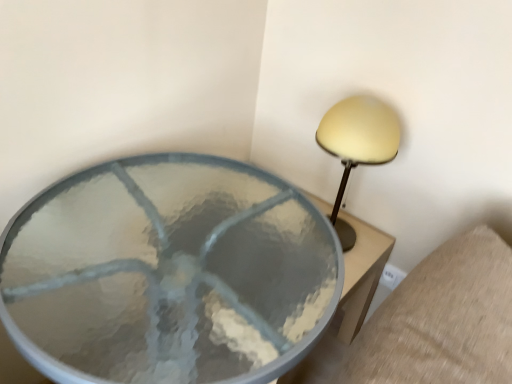
Question: From the image's perspective, is clear glass table at center above matte yellow lampshade at upper right?

Choices:
 (A) no
 (B) yes

Answer: (A)

Question: Can you confirm if clear glass table at center is taller than matte yellow lampshade at upper right?

Choices:
 (A) yes
 (B) no

Answer: (A)

Question: From a real-world perspective, is clear glass table at center physically above matte yellow lampshade at upper right?

Choices:
 (A) no
 (B) yes

Answer: (A)

Question: From a real-world perspective, does clear glass table at center sit lower than matte yellow lampshade at upper right?

Choices:
 (A) yes
 (B) no

Answer: (A)

Question: Is clear glass table at center positioned with its back to matte yellow lampshade at upper right?

Choices:
 (A) yes
 (B) no

Answer: (B)

Question: Is clear glass table at center closer to camera compared to matte yellow lampshade at upper right?

Choices:
 (A) yes
 (B) no

Answer: (A)

Question: Does matte yellow lampshade at upper right have a larger size compared to clear glass table at center?

Choices:
 (A) no
 (B) yes

Answer: (A)

Question: Could you tell me if matte yellow lampshade at upper right is facing clear glass table at center?

Choices:
 (A) no
 (B) yes

Answer: (B)

Question: Is matte yellow lampshade at upper right to the right of clear glass table at center from the viewer's perspective?

Choices:
 (A) yes
 (B) no

Answer: (A)

Question: Considering the relative sizes of matte yellow lampshade at upper right and clear glass table at center in the image provided, is matte yellow lampshade at upper right smaller than clear glass table at center?

Choices:
 (A) no
 (B) yes

Answer: (B)

Question: Can you confirm if matte yellow lampshade at upper right is thinner than clear glass table at center?

Choices:
 (A) yes
 (B) no

Answer: (A)

Question: Is matte yellow lampshade at upper right closer to the viewer compared to clear glass table at center?

Choices:
 (A) yes
 (B) no

Answer: (B)

Question: Choose the correct answer: Is clear glass table at center inside matte yellow lampshade at upper right or outside it?

Choices:
 (A) outside
 (B) inside

Answer: (A)